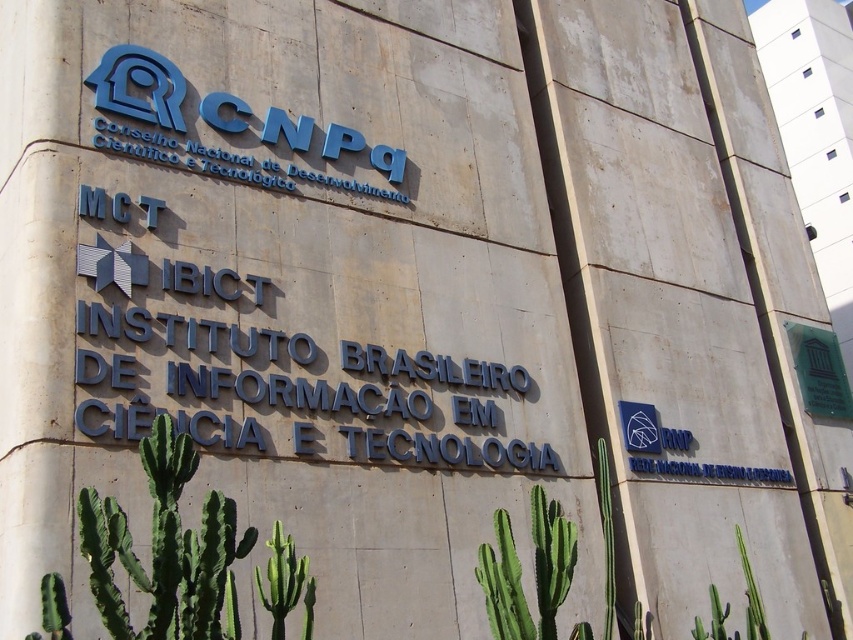
You are a visitor trying to locate the CNPq office. You see a blue metallic sign at upper center and a green glass plaque at upper right. Which one is more to the left?

The blue metallic sign at upper center is more to the left side of the green glass plaque at upper right.

You are a delivery person approaching the building and need to read the signs on the wall. Which sign will you see first as you approach the building? The blue metallic sign at upper center or the green glass plaque at upper right?

The blue metallic sign at upper center is in front of the green glass plaque at upper right, so you will see the blue metallic sign at upper center first as you approach the building.

You are a gardener who needs to determine which cactus is taller to decide where to place a taller pot. Looking at the green spiny cactus at lower left and the green spiky cactus at lower center in the scene, which one should you choose?

The green spiny cactus at lower left is taller than the green spiky cactus at lower center, so you should choose the green spiny cactus at lower left for the taller pot.